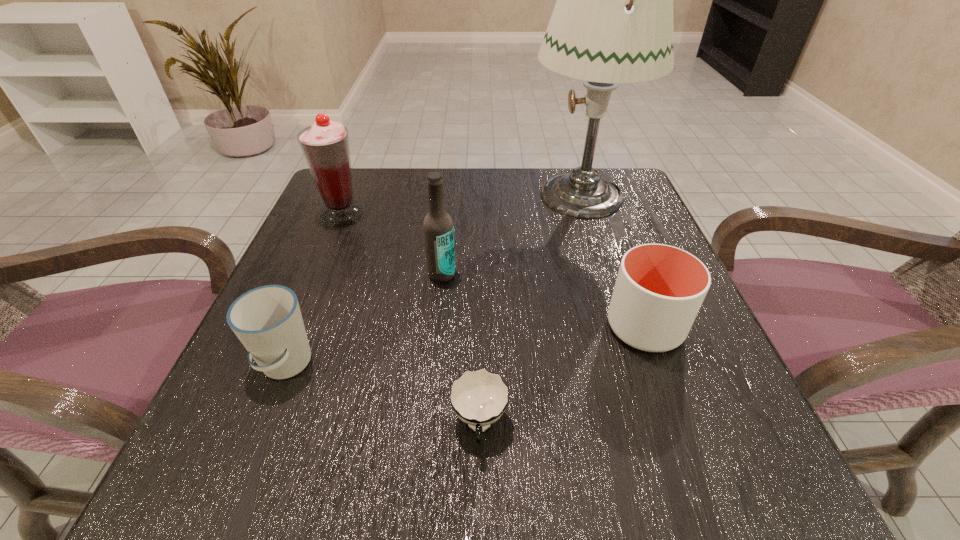
You are a GUI agent. You are given a task and a screenshot of the screen. Output one action in this format:
    pyautogui.click(x=<x>, y=<y>)
    Task: Click on the lampshade that is at the right edge
    
    Given the screenshot: What is the action you would take?
    pyautogui.click(x=612, y=23)

At what (x,y) coordinates should I click in order to perform the action: click on cup that is at the right edge. Please return your answer as a coordinate pair (x, y). Looking at the image, I should click on (659, 289).

Identify the location of object situated at the far left corner. The width and height of the screenshot is (960, 540). (325, 145).

Find the location of a particular element. Image resolution: width=960 pixels, height=540 pixels. object at the far right corner is located at coordinates 612,23.

Locate an element on the screen. free space at the far edge of the desktop is located at coordinates (459, 172).

I want to click on vacant area at the left edge of the desktop, so click(x=355, y=274).

At what (x,y) coordinates should I click in order to perform the action: click on vacant space at the right edge of the desktop. Please return your answer as a coordinate pair (x, y). This screenshot has height=540, width=960. Looking at the image, I should click on (693, 404).

This screenshot has width=960, height=540. In the image, there is a desktop. In order to click on vacant space at the far left corner in this screenshot , I will do `click(353, 168)`.

Locate an element on the screen. The image size is (960, 540). vacant space at the near left corner is located at coordinates (219, 443).

In order to click on free region at the far right corner of the desktop in this screenshot , I will do `click(642, 200)`.